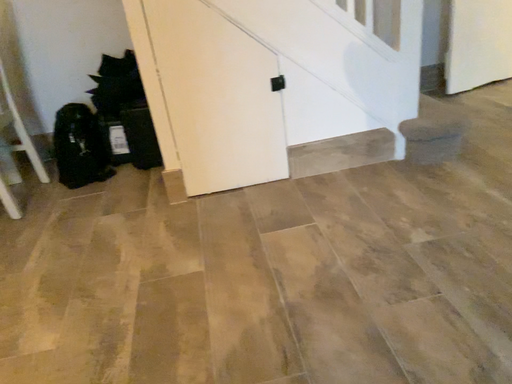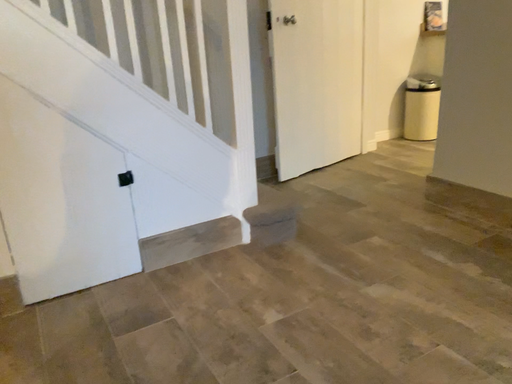
Question: Which way did the camera rotate in the video?

Choices:
 (A) rotated downward
 (B) rotated upward

Answer: (B)